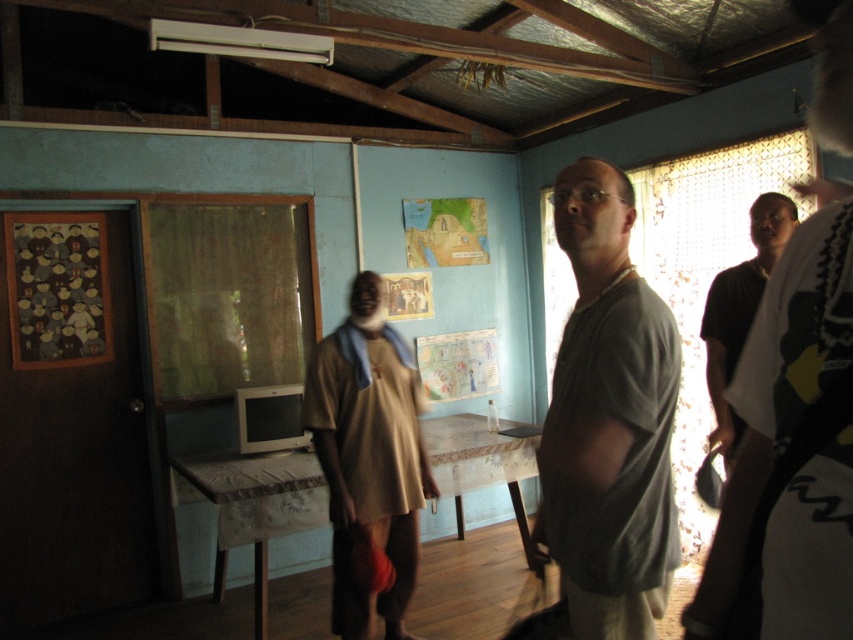
Question: Which is farther from the brown fabric dress at center?

Choices:
 (A) dark brown shirt at right
 (B) gray matte shirt at center

Answer: (B)

Question: Which of the following is the closest to the observer?

Choices:
 (A) (608, 490)
 (B) (335, 588)
 (C) (762, 250)

Answer: (A)

Question: In this image, where is gray matte shirt at center located relative to brown fabric dress at center?

Choices:
 (A) below
 (B) above

Answer: (B)

Question: Is brown fabric dress at center to the right of dark brown shirt at right from the viewer's perspective?

Choices:
 (A) no
 (B) yes

Answer: (A)

Question: Is gray matte shirt at center behind brown fabric dress at center?

Choices:
 (A) yes
 (B) no

Answer: (B)

Question: Which point is closer to the camera taking this photo?

Choices:
 (A) (780, 224)
 (B) (625, 508)

Answer: (B)